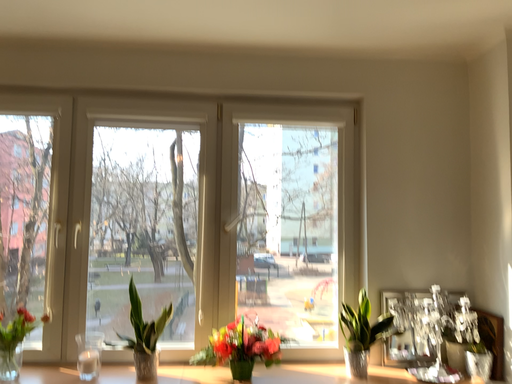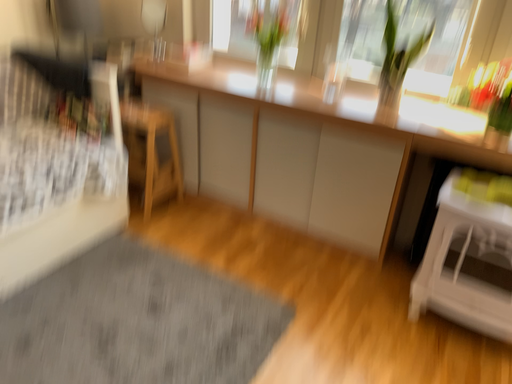
Question: Which way did the camera rotate in the video?

Choices:
 (A) rotated left
 (B) rotated right

Answer: (A)